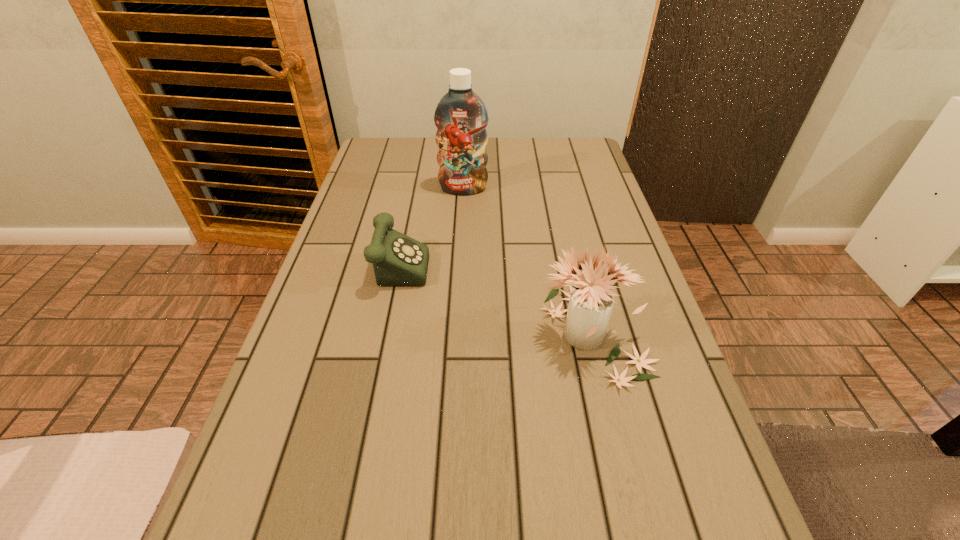
Image resolution: width=960 pixels, height=540 pixels. Identify the location of vacant space in between the shampoo and the leftmost object. (429, 224).

Where is `object that is the closest to the farthest object`? object that is the closest to the farthest object is located at coordinates (398, 260).

Point out which object is positioned as the nearest to the second shortest object. Please provide its 2D coordinates. Your answer should be formatted as a tuple, i.e. [(x, y)], where the tuple contains the x and y coordinates of a point satisfying the conditions above.

[(398, 260)]

Where is `vacant area that satisfies the following two spatial constraints: 1. on the front label of the shampoo; 2. on the right side of the rightmost object`? vacant area that satisfies the following two spatial constraints: 1. on the front label of the shampoo; 2. on the right side of the rightmost object is located at coordinates (456, 334).

Locate an element on the screen. Image resolution: width=960 pixels, height=540 pixels. free point that satisfies the following two spatial constraints: 1. on the front label of the second object from right to left; 2. on the dial of the leftmost object is located at coordinates (460, 260).

Where is `free location that satisfies the following two spatial constraints: 1. on the dial of the second shortest object; 2. on the left side of the shortest object`? free location that satisfies the following two spatial constraints: 1. on the dial of the second shortest object; 2. on the left side of the shortest object is located at coordinates (380, 334).

Where is `free space that satisfies the following two spatial constraints: 1. on the dial of the leftmost object; 2. on the back side of the rightmost object`? free space that satisfies the following two spatial constraints: 1. on the dial of the leftmost object; 2. on the back side of the rightmost object is located at coordinates tap(380, 334).

This screenshot has height=540, width=960. In order to click on vacant space that satisfies the following two spatial constraints: 1. on the dial of the rightmost object; 2. on the right side of the shortest object in this screenshot , I will do `click(380, 334)`.

You are a GUI agent. You are given a task and a screenshot of the screen. Output one action in this format:
    pyautogui.click(x=<x>, y=<y>)
    Task: Click on the free space in the image that satisfies the following two spatial constraints: 1. on the dial of the bouquet; 2. on the left side of the shortest object
    Image resolution: width=960 pixels, height=540 pixels.
    Given the screenshot: What is the action you would take?
    pyautogui.click(x=380, y=334)

You are a GUI agent. You are given a task and a screenshot of the screen. Output one action in this format:
    pyautogui.click(x=<x>, y=<y>)
    Task: Click on the free location that satisfies the following two spatial constraints: 1. on the front label of the shampoo; 2. on the dial of the telephone
    
    Given the screenshot: What is the action you would take?
    pyautogui.click(x=460, y=260)